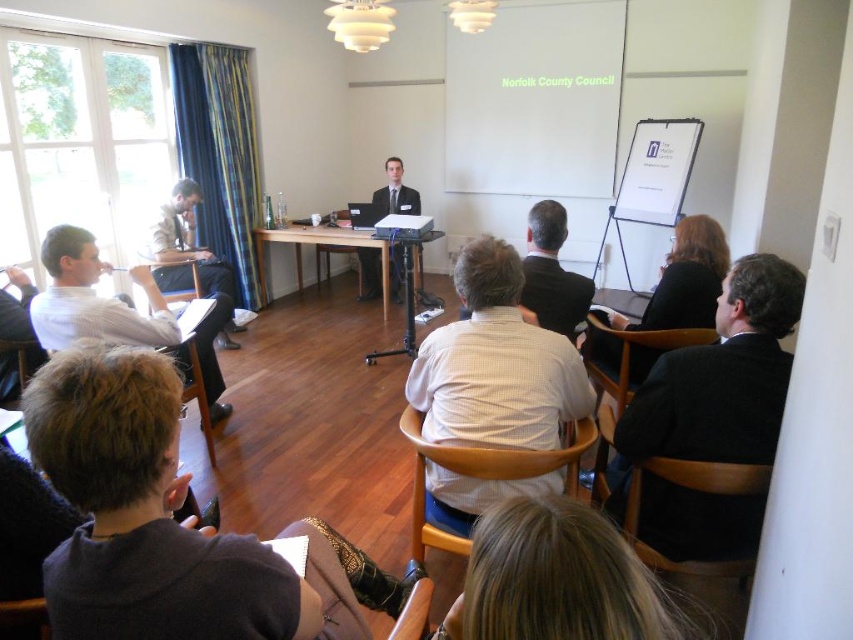
You are an attendee in the meeting and want to hand a document to the person in the dark gray suit at center. Since you are currently sitting in the white shirt at left, which direction should you move to reach them?

The white shirt at left is below the dark gray suit at center, so you should move upward to reach them.

You are organizing a coat rack for the attendees of the meeting. The light brown leather jacket at left and the dark suit at center need to be hung. Since the coat rack has limited space, which one requires more space due to its size?

The light brown leather jacket at left requires more space because it is bigger than the dark suit at center.

Looking at this image, you are organizing a photo shoot in this conference room and need to position two models wearing the white checkered shirt at center and the white shirt at left. Based on their spatial requirements, which model should you place first to ensure both fit comfortably in the frame?

The white checkered shirt at center requires less space than the white shirt at left, so you should place the model wearing the white shirt at left first to accommodate their larger space needs, then position the smaller one afterward.